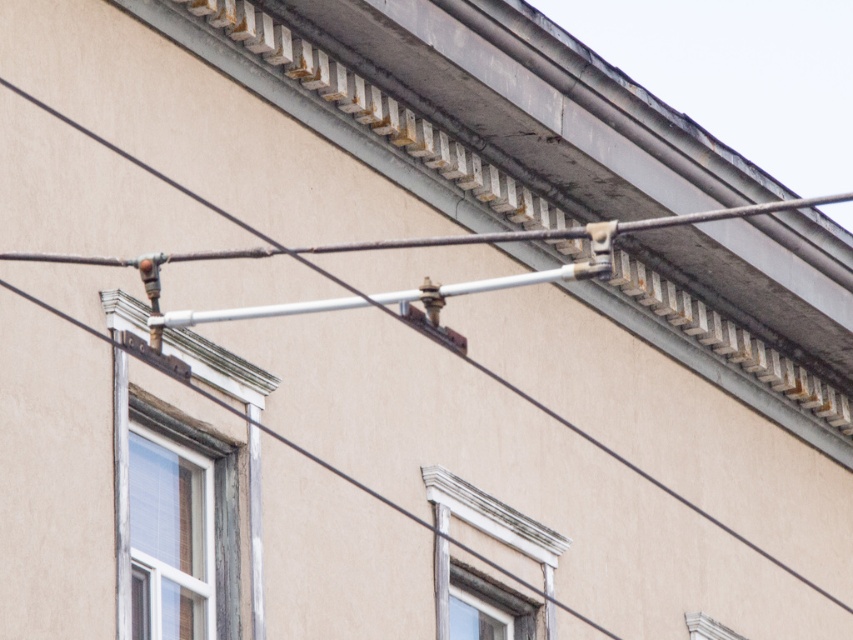
You are standing in front of the building and notice the wooden window at left. Can you determine its exact position relative to the roofline?

The wooden window at left is located at point 0.777 along the horizontal axis and 0.252 along the vertical axis, which places it below the roofline since its vertical coordinate is less than 1.

You are an architect analyzing the building facade. You see the white painted wood window at center and the wooden window frame at lower center. Which window has a greater height?

The white painted wood window at center is taller than the wooden window frame at lower center.